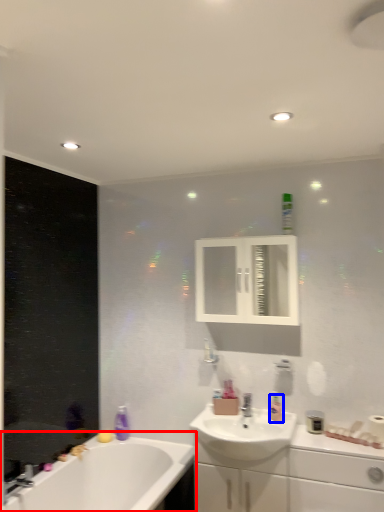
Question: Which object appears farthest to the camera in this image, bathtub (highlighted by a red box) or toiletry (highlighted by a blue box)?

Choices:
 (A) bathtub
 (B) toiletry

Answer: (B)